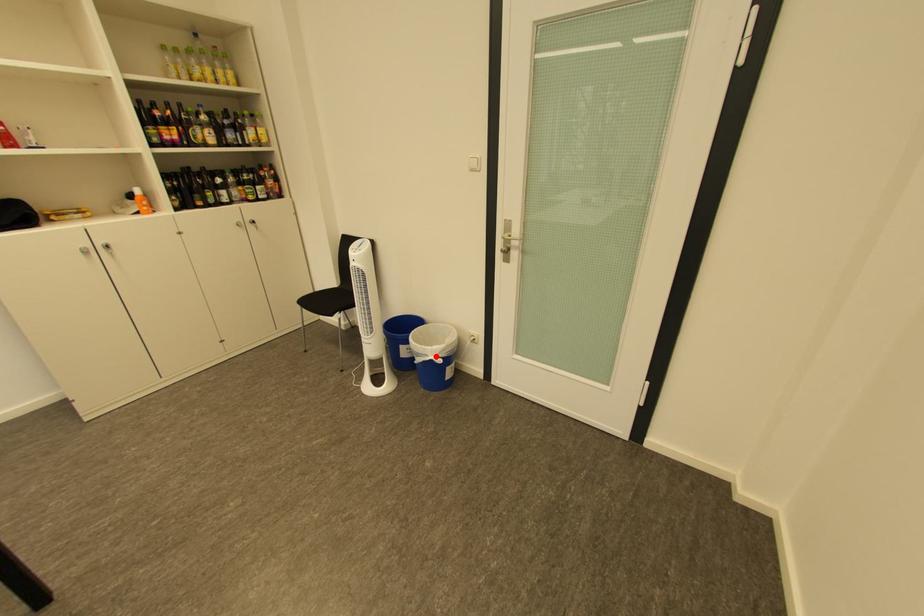
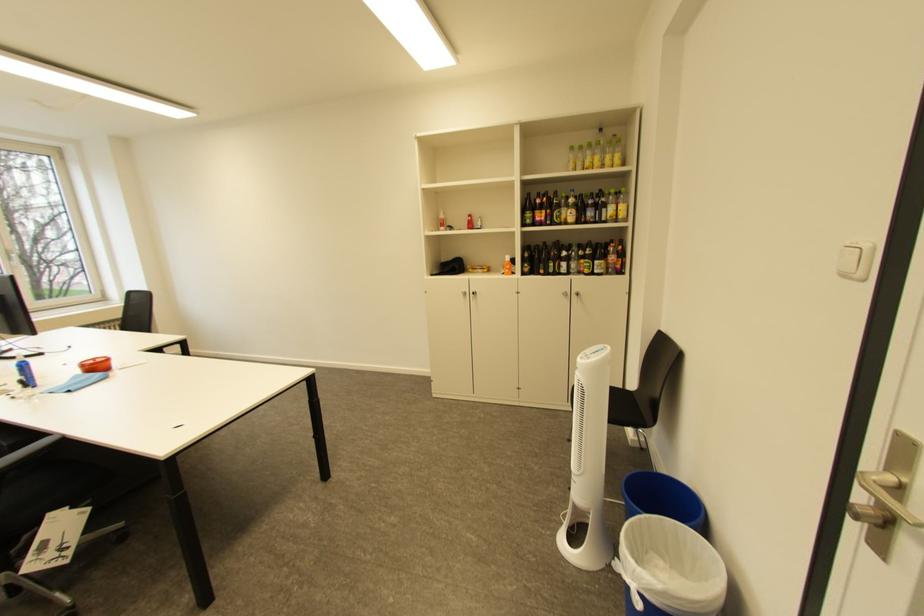
In the second image, find the point that corresponds to the highlighted location in the first image.

(636, 570)